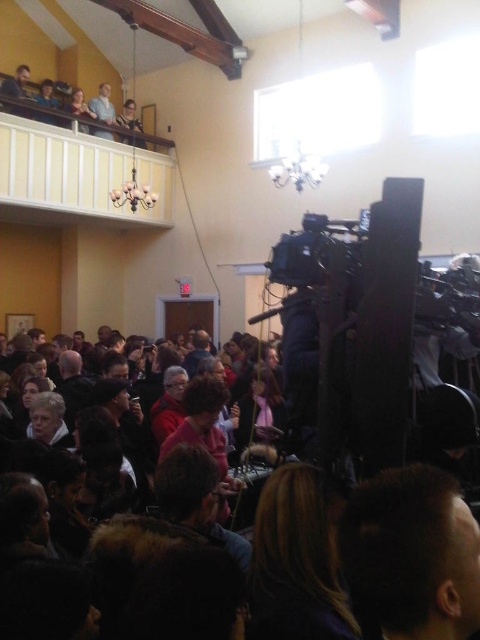
You are attending a meeting in the community hall and need to adjust the camera setup. You notice the dark brown hair at center and the light brown wooden chair at upper center. Which object is positioned to the right side of the other?

The dark brown hair at center is to the right of the light brown wooden chair at upper center.

You are standing in the community hall and want to move from the camera setup to the nearest exit, which is located at point (x=105, y=97). However, there are people seated at point (x=204, y=372). Can you walk directly from the camera setup to the exit without going around the seated group?

Point (x=204, y=372) is closer to the viewer than point (x=105, y=97), so the seated group at point (x=204, y=372) is between you and the exit at point (x=105, y=97). Therefore, you would need to go around the seated group to reach the exit.